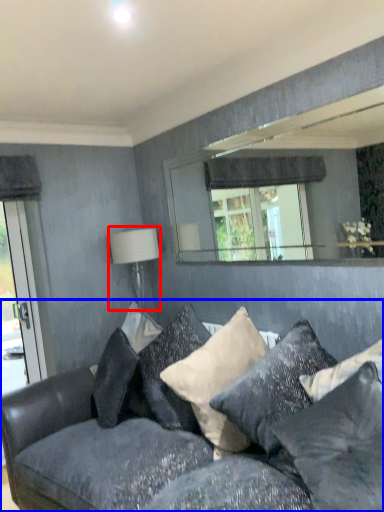
Question: Which object is further to the camera taking this photo, table lamp (highlighted by a red box) or studio couch (highlighted by a blue box)?

Choices:
 (A) table lamp
 (B) studio couch

Answer: (A)